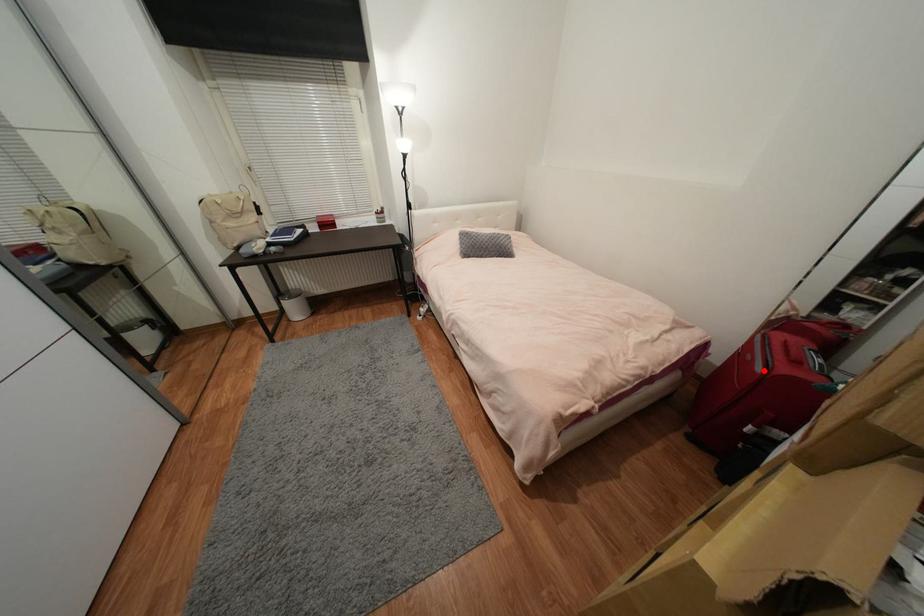
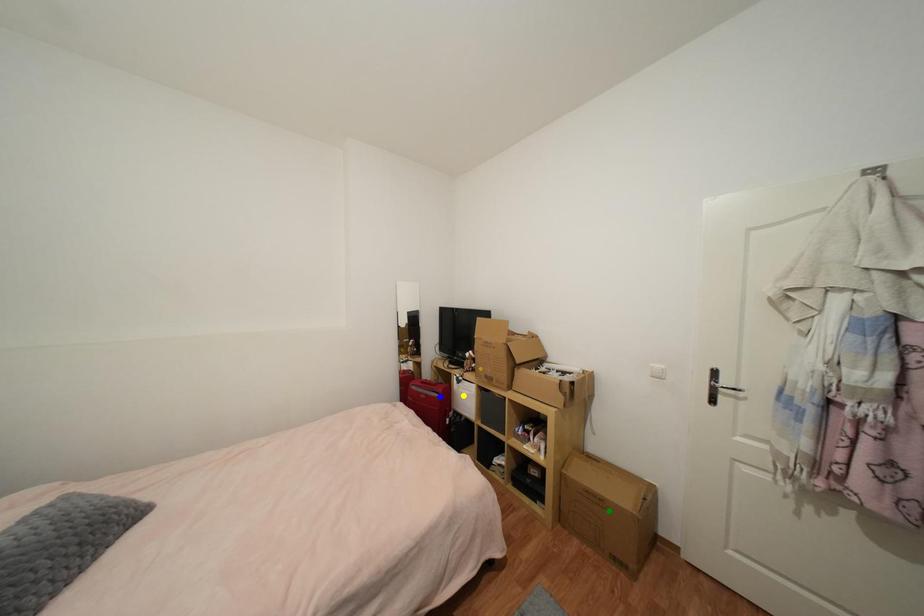
Question: I am providing you with two images of the same scene from different viewpoints. A red point is marked on the first image. You are given multiple points on the second image. Which point in image 2 represents the same 3d spot as the red point in image 1?

Choices:
 (A) green point
 (B) blue point
 (C) yellow point

Answer: (B)